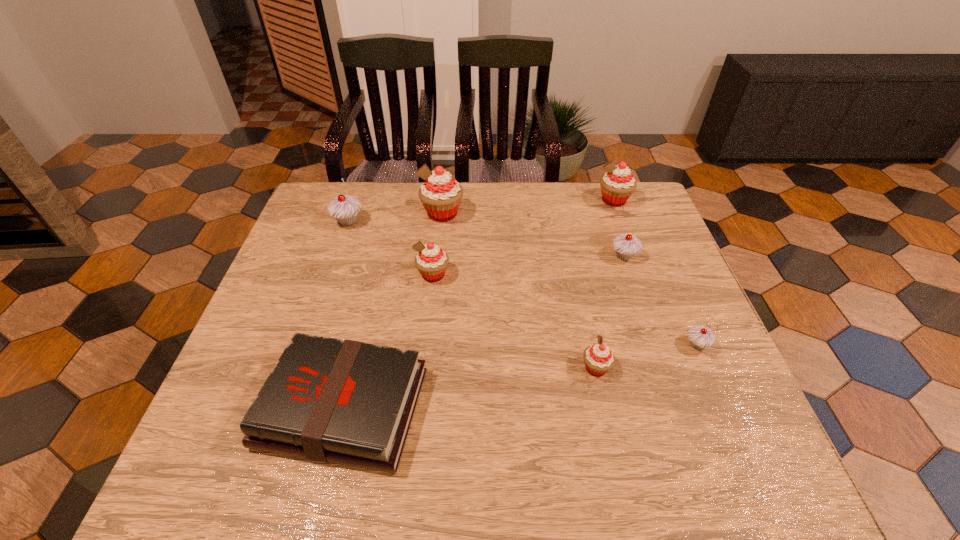
This screenshot has width=960, height=540. I want to click on vacant space situated 0.210m on the right of the red hardback book, so click(527, 407).

The height and width of the screenshot is (540, 960). In order to click on object positioned at the near edge in this screenshot , I will do `click(330, 400)`.

At what (x,y) coordinates should I click in order to perform the action: click on cupcake located at the left edge. Please return your answer as a coordinate pair (x, y). This screenshot has height=540, width=960. Looking at the image, I should click on (344, 209).

Identify the location of hardback book that is at the left edge. The image size is (960, 540). tap(330, 400).

Where is `object that is at the far left corner`? The width and height of the screenshot is (960, 540). object that is at the far left corner is located at coordinates (344, 209).

Where is `object that is at the near left corner`? Image resolution: width=960 pixels, height=540 pixels. object that is at the near left corner is located at coordinates (330, 400).

This screenshot has width=960, height=540. In order to click on object that is positioned at the far right corner in this screenshot , I will do `click(617, 185)`.

The width and height of the screenshot is (960, 540). Find the location of `free spot at the far edge of the desktop`. free spot at the far edge of the desktop is located at coordinates tap(382, 185).

Where is `free spot at the left edge of the desktop`? free spot at the left edge of the desktop is located at coordinates (234, 390).

Identify the location of vacant region at the right edge. (630, 290).